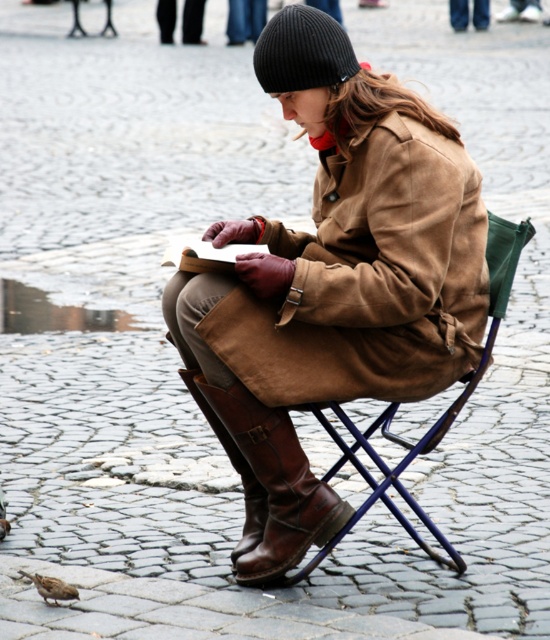
Can you confirm if blue metal folding chair at center is thinner than brown feathered pigeon at lower left?

No, blue metal folding chair at center is not thinner than brown feathered pigeon at lower left.

Which of these two, blue metal folding chair at center or brown feathered pigeon at lower left, stands taller?

blue metal folding chair at center is taller.

Does point (397, 404) come closer to viewer compared to point (29, 573)?

No.

Find the location of a particular element. blue metal folding chair at center is located at coordinates (432, 422).

This screenshot has height=640, width=550. What do you see at coordinates (236, 472) in the screenshot?
I see `brown leather boot at lower center` at bounding box center [236, 472].

Which is in front, point (245, 522) or point (37, 586)?

Positioned in front is point (37, 586).

Locate an element on the screen. The width and height of the screenshot is (550, 640). brown leather boot at lower center is located at coordinates (236, 472).

The image size is (550, 640). In order to click on brown leather boot at lower center in this screenshot , I will do `click(236, 472)`.

Can you confirm if brown leather boot at center is taller than brown feathered pigeon at lower left?

Yes, brown leather boot at center is taller than brown feathered pigeon at lower left.

Does brown leather boot at center lie in front of brown feathered pigeon at lower left?

That is False.

Is point (301, 451) farther from viewer compared to point (69, 596)?

Yes, it is.

Locate an element on the screen. This screenshot has width=550, height=640. brown leather boot at center is located at coordinates (276, 484).